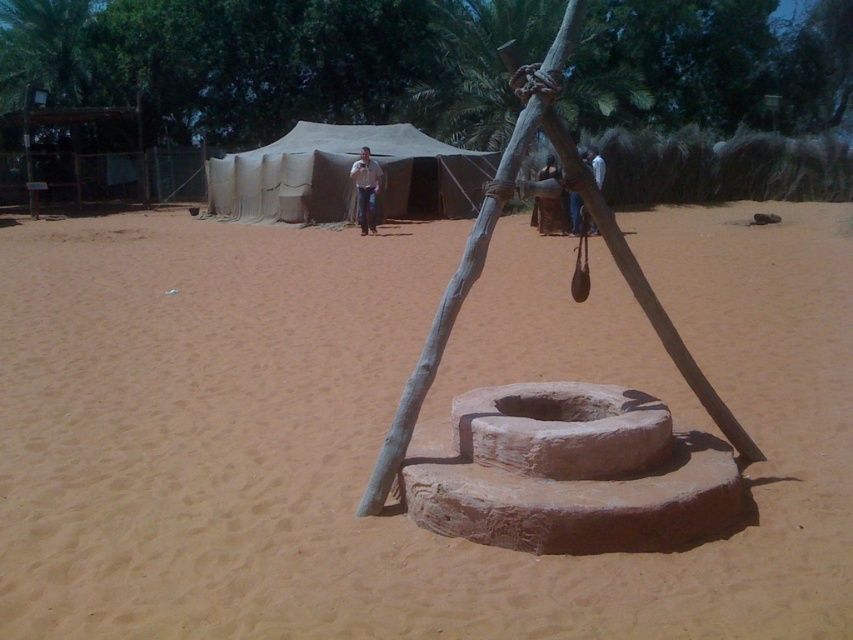
Question: Considering the relative positions of beige canvas tent at center and gray wood pole at center in the image provided, where is beige canvas tent at center located with respect to gray wood pole at center?

Choices:
 (A) below
 (B) above

Answer: (B)

Question: Estimate the real-world distances between objects in this image. Which object is closer to the brown leather bag at center?

Choices:
 (A) beige canvas tent at center
 (B) white shirt at center
 (C) gray wood pole at center
 (D) brown sandy dirt at center

Answer: (B)

Question: Which point appears farthest from the camera in this image?

Choices:
 (A) (467, 289)
 (B) (561, 220)

Answer: (B)

Question: Is beige canvas tent at center bigger than gray wood pole at center?

Choices:
 (A) yes
 (B) no

Answer: (B)

Question: Estimate the real-world distances between objects in this image. Which object is closer to the gray wood pole at center?

Choices:
 (A) brown leather bag at center
 (B) brown sandy dirt at center

Answer: (B)

Question: Is brown sandy dirt at center below beige canvas tent at center?

Choices:
 (A) yes
 (B) no

Answer: (A)